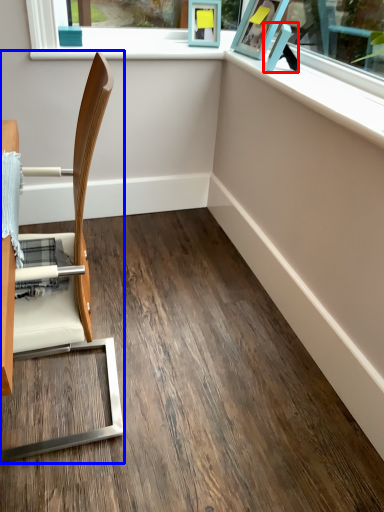
Question: Which object is closer to the camera taking this photo, picture frame (highlighted by a red box) or chair (highlighted by a blue box)?

Choices:
 (A) picture frame
 (B) chair

Answer: (B)